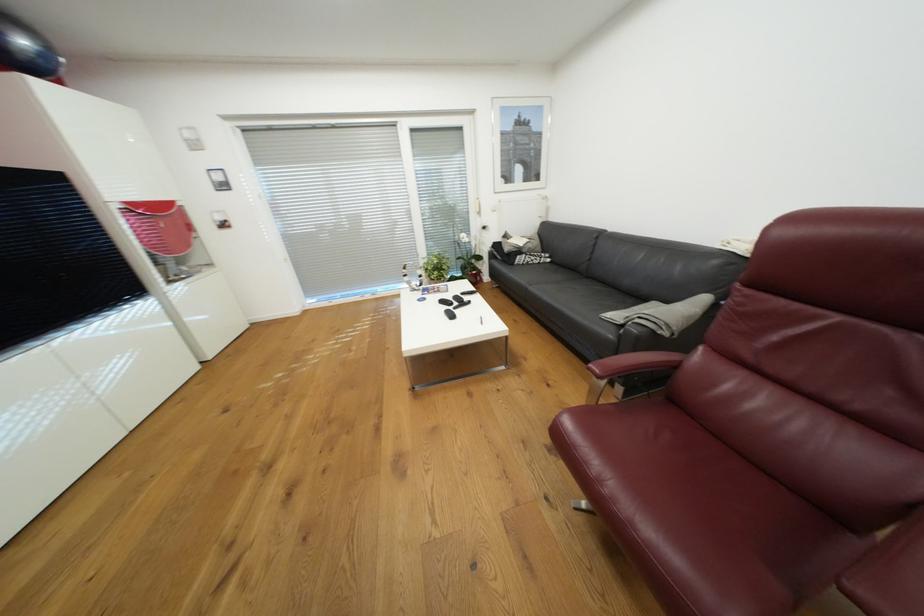
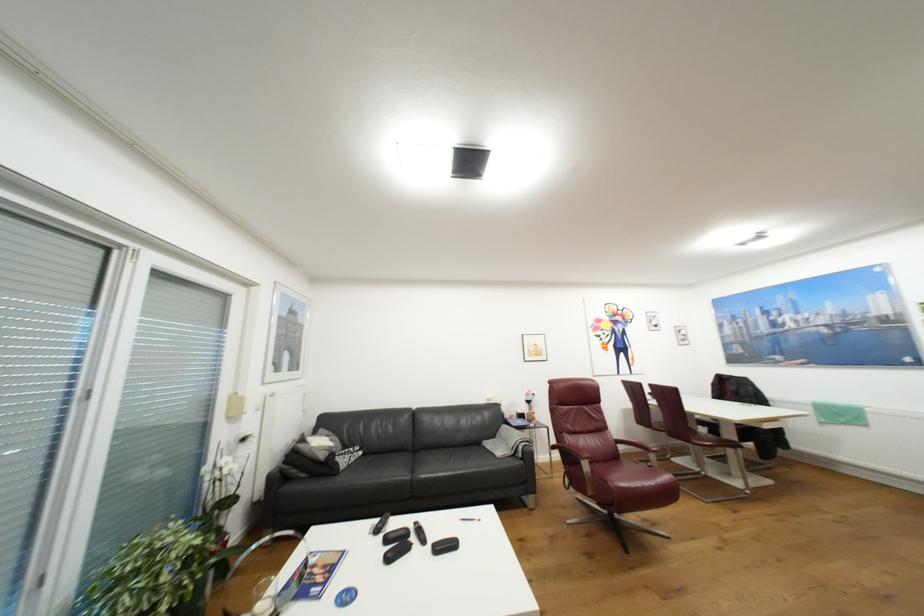
Question: I am providing you with two images of the same scene from different viewpoints. Which of the following objects are not visible in image2?

Choices:
 (A) black sofa armrest
 (B) blue circular lid
 (C) grey pillow
 (D) none of these

Answer: (D)